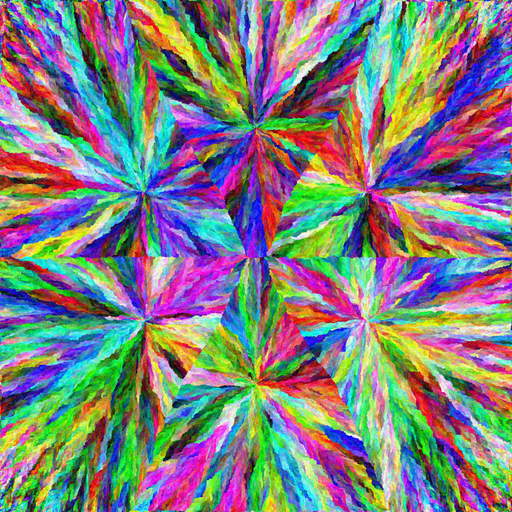
Image resolution: width=512 pixels, height=512 pixels. Find the location of `green paint`. green paint is located at coordinates (503, 430), (205, 362), (103, 374), (38, 280).